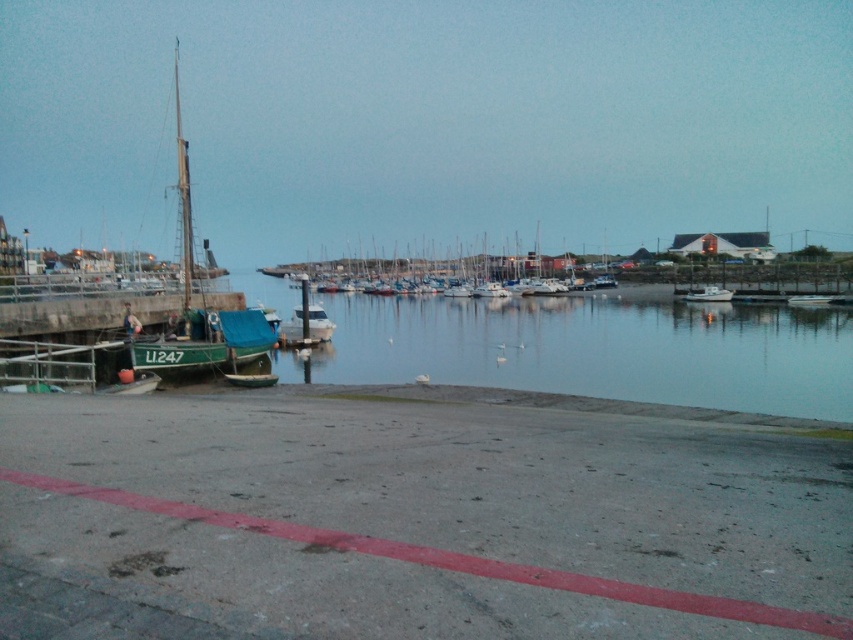
Can you confirm if green matte sailboat at left is bigger than white matte boats at center?

Yes.

Does green matte sailboat at left have a lesser height compared to white matte boats at center?

In fact, green matte sailboat at left may be taller than white matte boats at center.

Which is in front, point (177, 205) or point (366, 259)?

Point (366, 259) is in front.

You are a GUI agent. You are given a task and a screenshot of the screen. Output one action in this format:
    pyautogui.click(x=<x>, y=<y>)
    Task: Click on the green matte sailboat at left
    The image size is (853, 640).
    Given the screenshot: What is the action you would take?
    tap(202, 308)

Which is behind, point (473, 268) or point (683, 298)?

The point (473, 268) is more distant.

Can you confirm if white matte boats at center is wider than white matte boat at center-right?

Indeed, white matte boats at center has a greater width compared to white matte boat at center-right.

Where is `white matte boats at center`? The width and height of the screenshot is (853, 640). white matte boats at center is located at coordinates 428,268.

Who is higher up, green matte sailboat at left or white matte boat at center-right?

green matte sailboat at left

Is green matte sailboat at left below white matte boat at center-right?

Actually, green matte sailboat at left is above white matte boat at center-right.

This screenshot has width=853, height=640. Find the location of `green matte sailboat at left`. green matte sailboat at left is located at coordinates point(202,308).